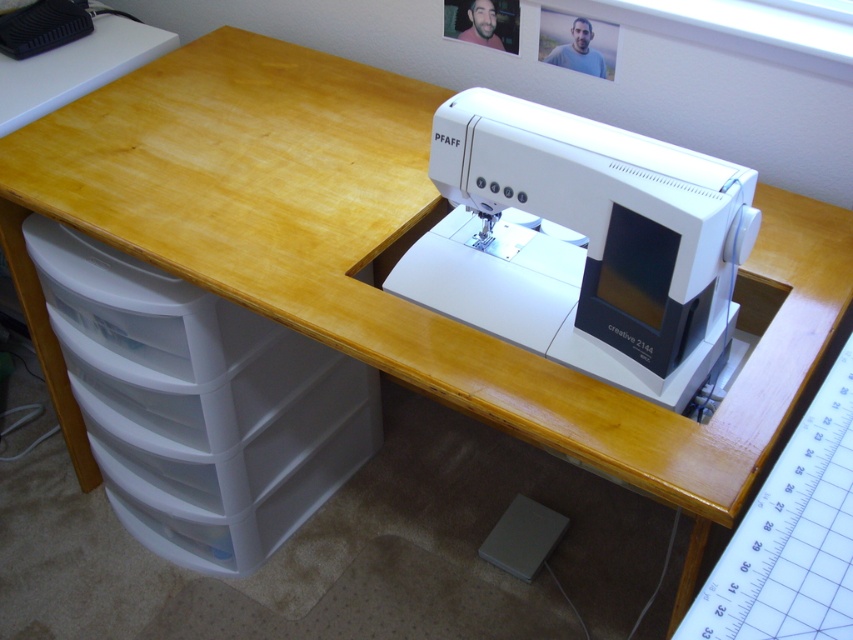
Does point (491, 224) come behind point (212, 310)?

No, (491, 224) is closer to viewer.

Is white plastic sewing machine at center closer to camera compared to white plastic drawer at lower left?

Yes.

Between point (589, 316) and point (281, 532), which one is positioned behind?

The point (281, 532) is behind.

You are a GUI agent. You are given a task and a screenshot of the screen. Output one action in this format:
    pyautogui.click(x=<x>, y=<y>)
    Task: Click on the white plastic sewing machine at center
    
    Given the screenshot: What is the action you would take?
    pyautogui.click(x=585, y=243)